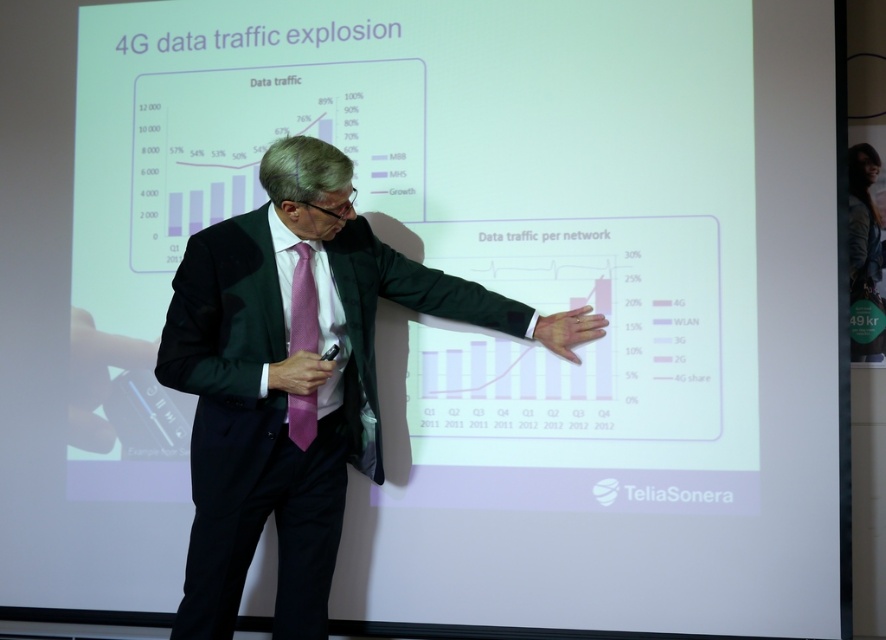
You are an event organizer who needs to ensure the presenter is visible to the audience. Given that the presenter is wearing a matte green suit at center and a pink textured tie at center, which item is more likely to be seen clearly by the audience from the back of the room?

The pink textured tie at center is more likely to be seen clearly from the back of the room because it is positioned above the matte green suit at center, making it higher and more visible.

You are an event organizer who needs to ensure that the speaker is visible to the audience. Considering the speaker is wearing a matte green suit at center and a pink textured tie at center, which item of clothing is more likely to catch the audience attention based on their sizes?

The matte green suit at center has a larger size compared to the pink textured tie at center, so the matte green suit at center is more likely to catch the audience attention due to its larger size.